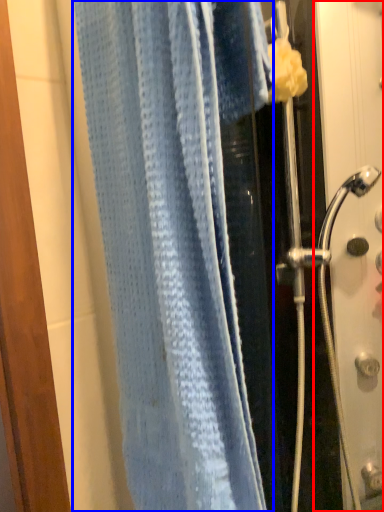
Question: Among these objects, which one is nearest to the camera, screen door (highlighted by a red box) or towel (highlighted by a blue box)?

Choices:
 (A) screen door
 (B) towel

Answer: (B)